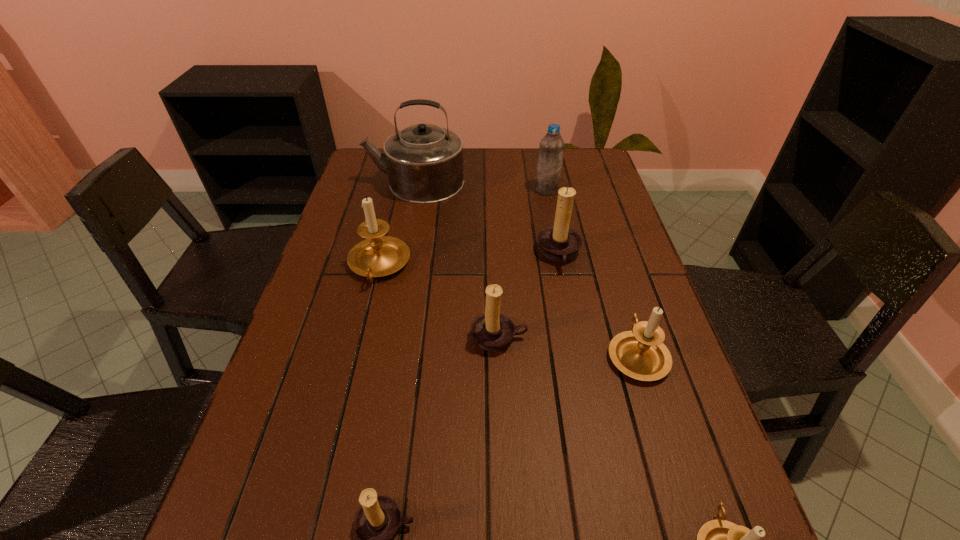
The width and height of the screenshot is (960, 540). What are the coordinates of `water bottle that is at the far edge` in the screenshot? It's located at (551, 148).

Locate an element on the screen. This screenshot has height=540, width=960. kettle that is positioned at the left edge is located at coordinates (424, 162).

At what (x,y) coordinates should I click in order to perform the action: click on candle holder at the left edge. Please return your answer as a coordinate pair (x, y). This screenshot has height=540, width=960. Looking at the image, I should click on (377, 256).

Identify the location of object at the far left corner. (424, 162).

You are a GUI agent. You are given a task and a screenshot of the screen. Output one action in this format:
    pyautogui.click(x=<x>, y=<y>)
    Task: Click on the vacant space at the far edge of the desktop
    The height and width of the screenshot is (540, 960).
    Given the screenshot: What is the action you would take?
    pyautogui.click(x=503, y=167)

In the image, there is a desktop. At what (x,y) coordinates should I click in order to perform the action: click on blank space at the left edge. Please return your answer as a coordinate pair (x, y). Image resolution: width=960 pixels, height=540 pixels. Looking at the image, I should click on (315, 457).

In the image, there is a desktop. Where is `vacant space at the right edge`? The image size is (960, 540). vacant space at the right edge is located at coordinates (610, 199).

Identify the location of empty space between the fourth candle holder from right to left and the water bottle. (523, 264).

Where is `vacant area that lies between the second biggest beige candle holder and the blue water bottle`? This screenshot has width=960, height=540. vacant area that lies between the second biggest beige candle holder and the blue water bottle is located at coordinates (591, 272).

The width and height of the screenshot is (960, 540). In order to click on free area in between the kettle and the third candle holder from left to right in this screenshot , I will do `click(457, 260)`.